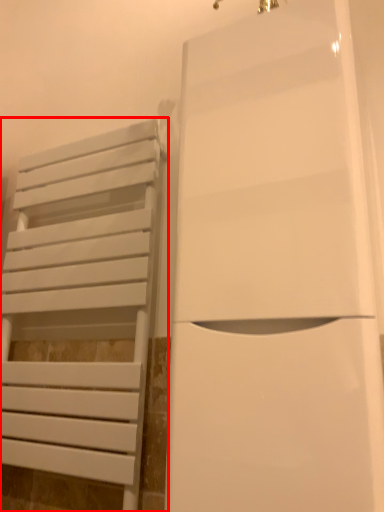
Question: Considering the relative positions of furniture (annotated by the red box) and door in the image provided, where is furniture (annotated by the red box) located with respect to the staircase?

Choices:
 (A) left
 (B) right

Answer: (A)